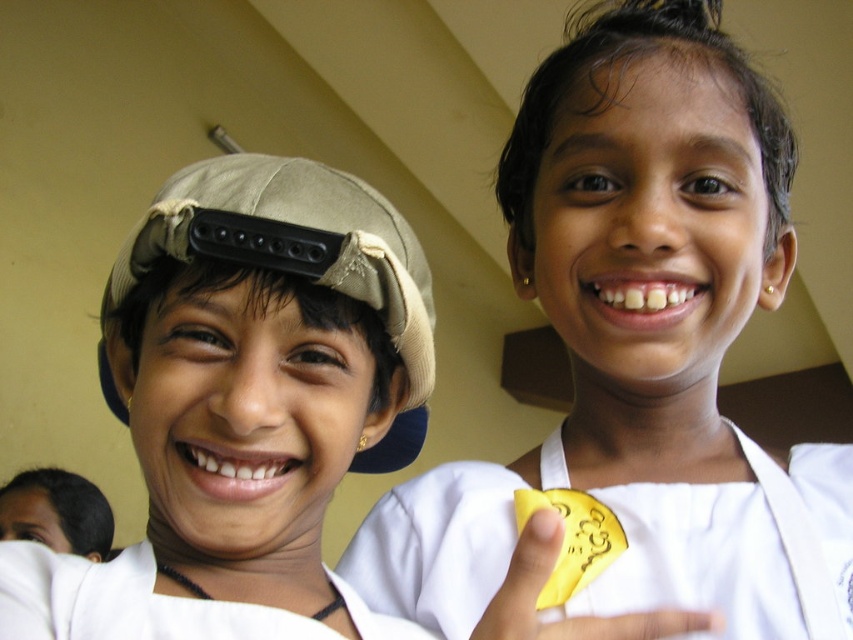
You are a treasure hunter searching for coins in the image. You see the gold shiny coin at upper right and the beige fabric baseball hat at left. Which object is located to the right of the other?

The gold shiny coin at upper right is positioned on the right side of beige fabric baseball hat at left.

You are a photographer setting up for a group photo. You notice two hats on the left side of the image. The matte beige cap at left and the beige fabric baseball hat at left. Can you determine if there is enough space between them to fit a 3.5 centimeter wide ribbon between them?

The matte beige cap at left is 3.61 centimeters from the beige fabric baseball hat at left. Since the distance between them is 3.61 centimeters and the ribbon is 3.5 centimeters wide, there is enough space to fit the ribbon between them.

You are a photographer trying to capture a clear shot of the gold shiny coin at upper right and the beige fabric baseball hat at left. Which object should you focus on first if you want to ensure both are in focus?

The gold shiny coin at upper right is above the beige fabric baseball hat at left, so you should focus on the gold shiny coin at upper right first to ensure both are in focus.